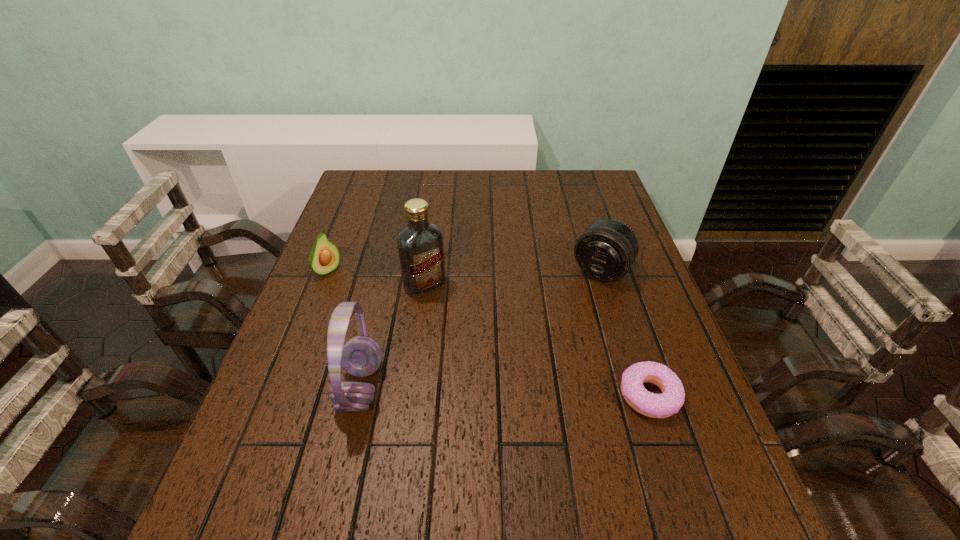
This screenshot has width=960, height=540. Find the location of `free space between the tallest object and the third shortest object`. free space between the tallest object and the third shortest object is located at coordinates (513, 277).

Identify the location of object that ranks as the closest to the telephoto lens. (653, 405).

Identify the location of object that is the closest to the doughnut. (606, 250).

Image resolution: width=960 pixels, height=540 pixels. Find the location of `vacant space that satisfies the following two spatial constraints: 1. on the front side of the avocado; 2. on the headband and ear cups of the headset`. vacant space that satisfies the following two spatial constraints: 1. on the front side of the avocado; 2. on the headband and ear cups of the headset is located at coordinates (283, 387).

I want to click on vacant space that satisfies the following two spatial constraints: 1. on the front side of the tallest object; 2. on the right side of the avocado, so click(x=323, y=285).